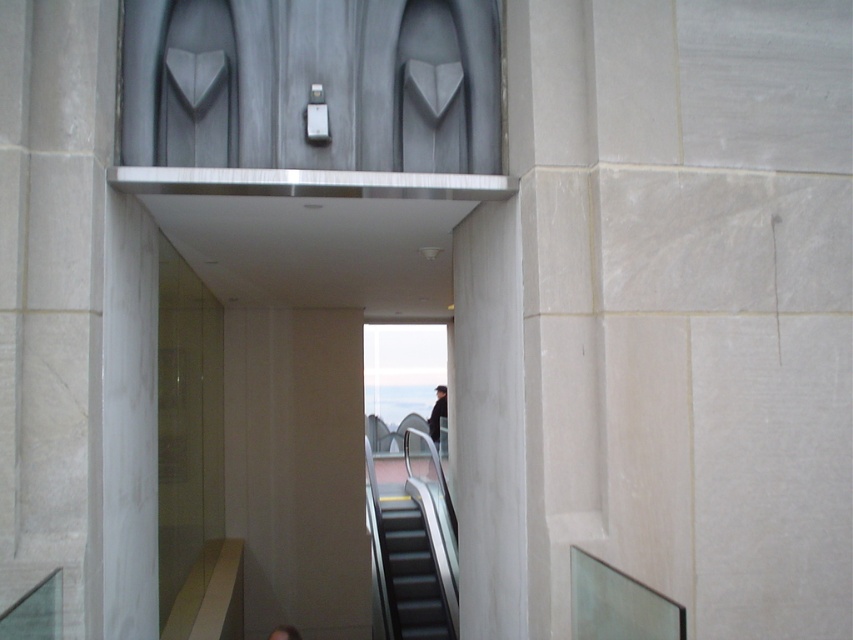
You are a delivery person carrying a large package and need to navigate through the corridor. You see the black rubber escalator at center and the black matte jacket at center. How far apart are these two objects?

The black rubber escalator at center and the black matte jacket at center are 4.84 meters apart from each other.

Consider the image. You are standing in the corridor and want to move towards the large arched opening. Which point, point (x=409, y=582) or point (x=434, y=396), is closer to the arched opening?

Point (x=409, y=582) is closer to the arched opening because it is in front of point (x=434, y=396).